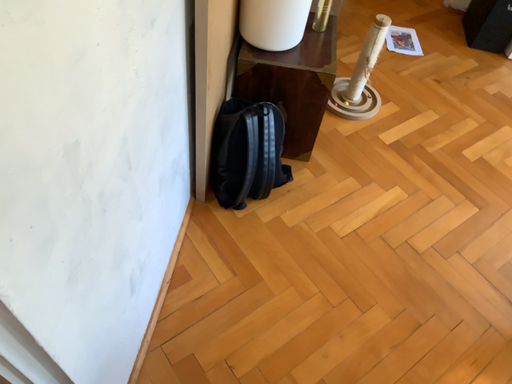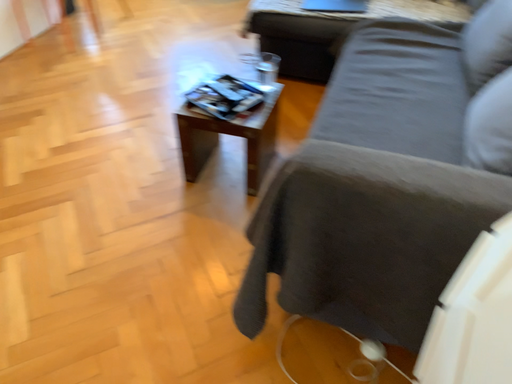
Question: Which way did the camera rotate in the video?

Choices:
 (A) rotated left
 (B) rotated right

Answer: (B)